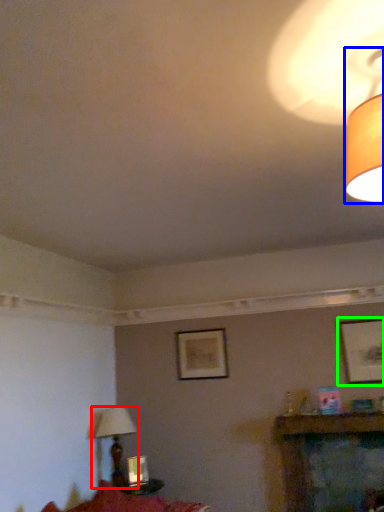
Question: Which is nearer to the lamp (highlighted by a red box)? lamp (highlighted by a blue box) or picture frame (highlighted by a green box).

Choices:
 (A) lamp
 (B) picture frame

Answer: (B)